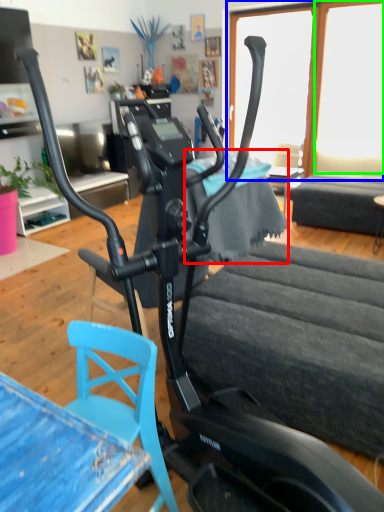
Question: Considering the real-world distances, which object is farthest from fabric (highlighted by a red box)? window screen (highlighted by a blue box) or window screen (highlighted by a green box)?

Choices:
 (A) window screen
 (B) window screen

Answer: (B)